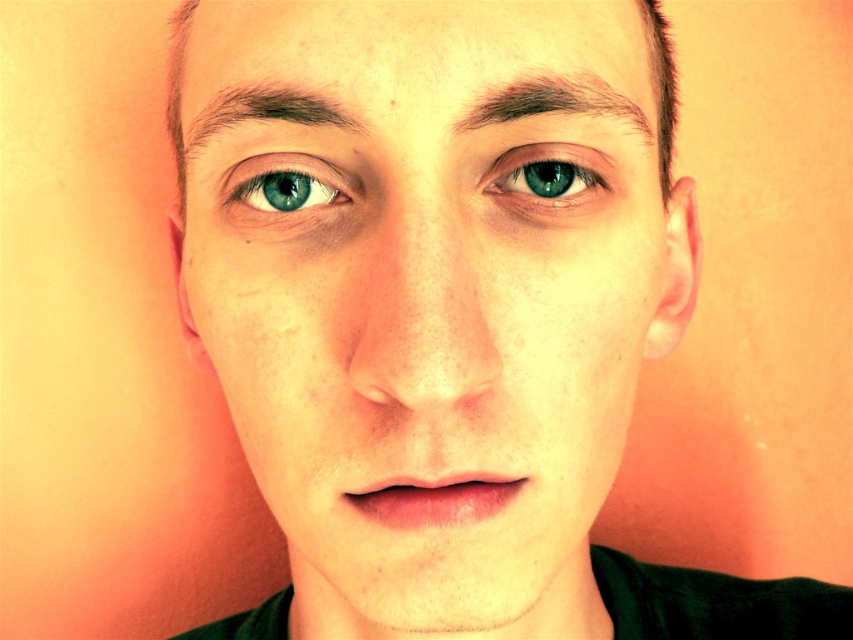
Question: Is green glossy eye at center positioned behind brown hair at upper center?

Choices:
 (A) yes
 (B) no

Answer: (A)

Question: Does smooth skin face at center have a greater width compared to brown hair at upper center?

Choices:
 (A) no
 (B) yes

Answer: (B)

Question: Which object is the farthest from the blue glossy eye at center?

Choices:
 (A) brown hair at upper center
 (B) green glossy eye at center
 (C) smooth skin face at center
 (D) dark brown hair at upper center

Answer: (C)

Question: Can you confirm if smooth skin face at center is thinner than dark brown hair at upper center?

Choices:
 (A) no
 (B) yes

Answer: (A)

Question: Which object is the farthest from the blue glossy eye at center?

Choices:
 (A) brown hair at upper center
 (B) dark brown hair at upper center
 (C) green glossy eye at center

Answer: (B)

Question: Estimate the real-world distances between objects in this image. Which object is farther from the dark brown hair at upper center?

Choices:
 (A) smooth skin face at center
 (B) blue glossy eye at center
 (C) brown hair at upper center
 (D) green glossy eye at center

Answer: (A)